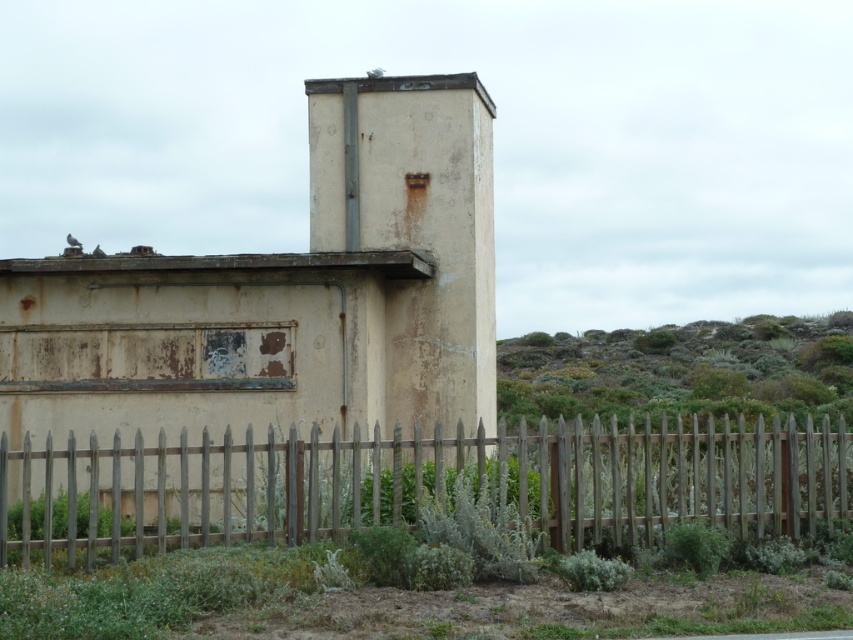
Question: Is rusty concrete chimney at center below weathered wood fence at lower center?

Choices:
 (A) no
 (B) yes

Answer: (A)

Question: In this image, where is rusty concrete chimney at center located relative to weathered wood fence at lower center?

Choices:
 (A) left
 (B) right

Answer: (A)

Question: Which of the following is the farthest from the observer?

Choices:
 (A) (61, 452)
 (B) (18, 380)

Answer: (B)

Question: In this image, where is rusty concrete chimney at center located relative to weathered wood fence at lower center?

Choices:
 (A) right
 (B) left

Answer: (B)

Question: Which point is closer to the camera?

Choices:
 (A) weathered wood fence at lower center
 (B) rusty concrete chimney at center

Answer: (A)